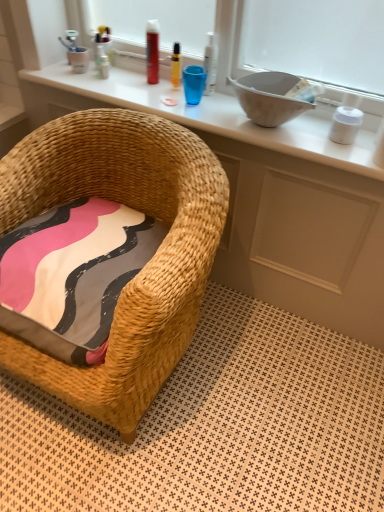
Identify the location of free space between white plastic bottle at upper center, placed as the 5th toiletry when sorted from right to left, and translucent yellow bottle at upper center, placed as the third toiletry when sorted from right to left. (133, 84).